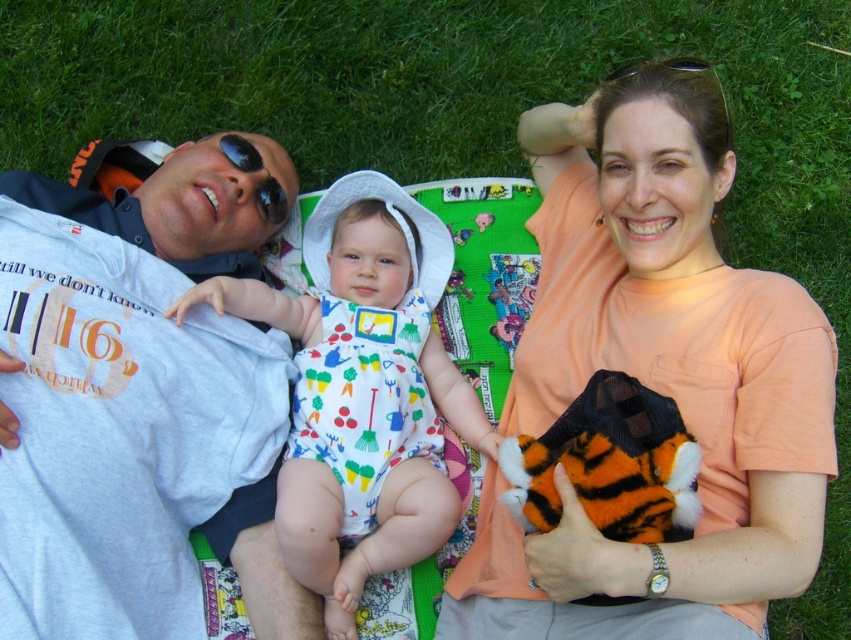
Measure the distance between orange cotton shirt at upper right and camera.

They are 1.28 meters apart.

Does orange cotton shirt at upper right lie in front of gray cotton t-shirt at left?

Yes, it is.

The image size is (851, 640). I want to click on orange cotton shirt at upper right, so click(655, 378).

Does orange cotton shirt at upper right come in front of printed cotton onesie at center?

Yes, it is.

Who is more distant from viewer, [752,589] or [410,467]?

The point [410,467] is more distant.

Identify the location of orange cotton shirt at upper right. (655, 378).

Is printed cotton onesie at center bigger than gray cotton t-shirt at left?

Yes, printed cotton onesie at center is bigger than gray cotton t-shirt at left.

Does printed cotton onesie at center come in front of gray cotton t-shirt at left?

Yes, it is in front of gray cotton t-shirt at left.

This screenshot has width=851, height=640. I want to click on printed cotton onesie at center, so click(363, 394).